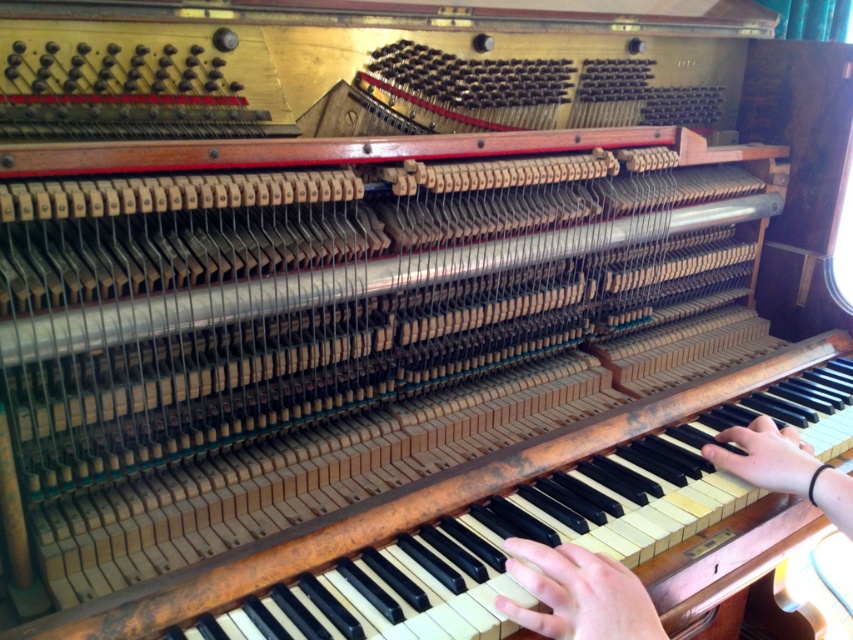
Question: Is light skin tone flesh at lower center further to the viewer compared to light skin tone hand at right?

Choices:
 (A) yes
 (B) no

Answer: (B)

Question: Which point is closer to the camera?

Choices:
 (A) light skin tone hand at right
 (B) light skin tone flesh at lower center

Answer: (B)

Question: Does light skin tone flesh at lower center lie behind light skin tone hand at right?

Choices:
 (A) yes
 (B) no

Answer: (B)

Question: Which of the following is the closest to the observer?

Choices:
 (A) light skin tone flesh at lower center
 (B) smooth skin hand at center
 (C) light skin tone hand at right

Answer: (A)

Question: Considering the real-world distances, which object is farthest from the light skin tone flesh at lower center?

Choices:
 (A) light skin tone hand at right
 (B) smooth skin hand at center

Answer: (A)

Question: Is smooth skin hand at center bigger than light skin tone hand at right?

Choices:
 (A) yes
 (B) no

Answer: (A)